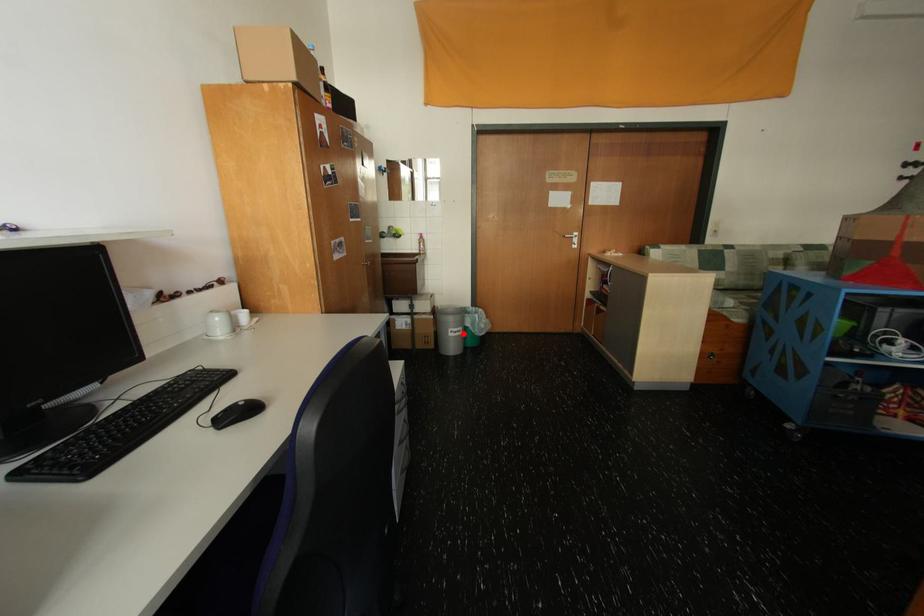
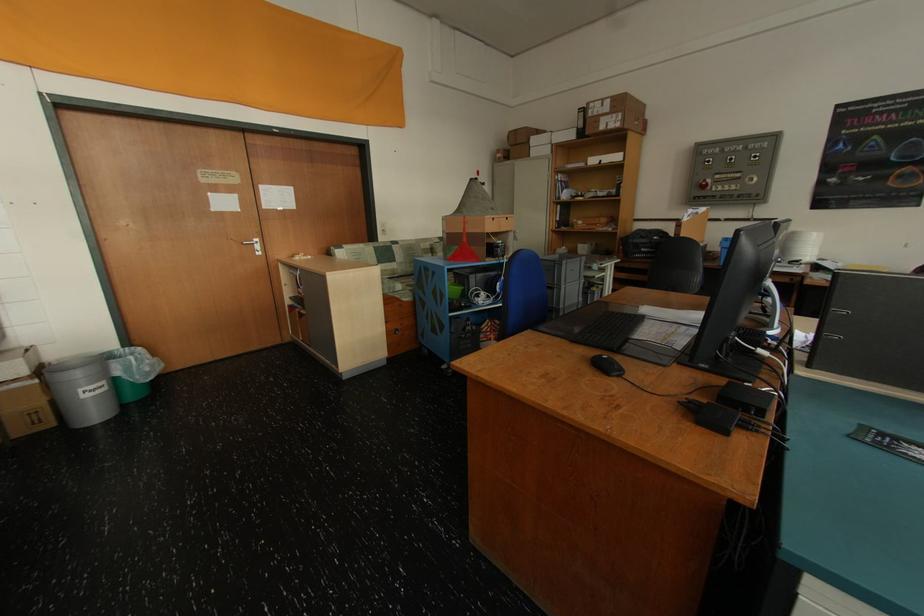
In the second image, find the point that corresponds to the highlighted location in the first image.

(101, 392)